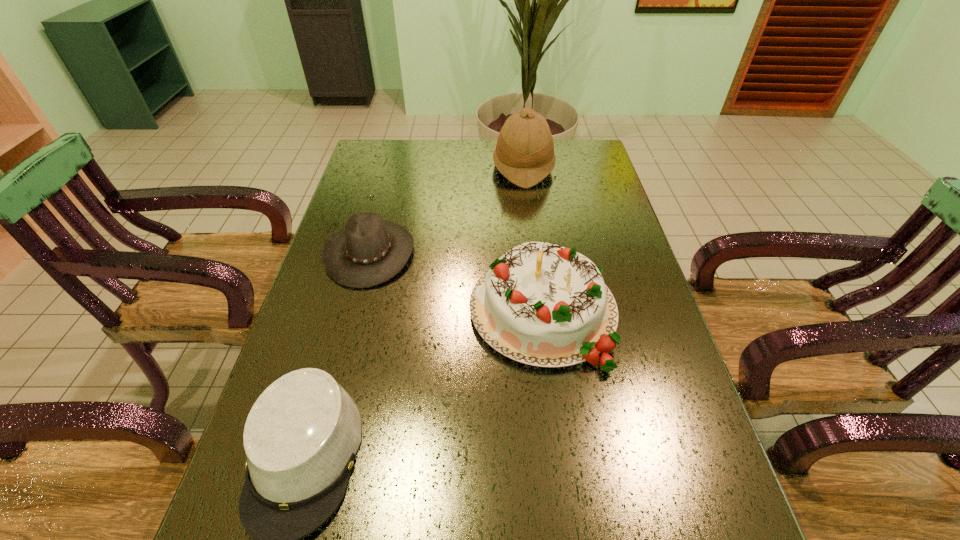
This screenshot has width=960, height=540. I want to click on object at the left edge, so click(x=368, y=251).

The image size is (960, 540). I want to click on object situated at the right edge, so click(x=541, y=304).

Where is `blank space at the far edge of the desktop`? The width and height of the screenshot is (960, 540). blank space at the far edge of the desktop is located at coordinates (429, 169).

Image resolution: width=960 pixels, height=540 pixels. Identify the location of vacant space at the left edge of the desktop. (396, 175).

The image size is (960, 540). In order to click on vacant space at the right edge of the desktop in this screenshot , I will do `click(591, 238)`.

This screenshot has height=540, width=960. In order to click on free spot at the far right corner of the desktop in this screenshot , I will do `click(574, 151)`.

Image resolution: width=960 pixels, height=540 pixels. I want to click on vacant space that is in between the second nearest hat and the farthest object, so click(x=446, y=210).

This screenshot has height=540, width=960. What are the coordinates of `unoccupied position between the rightmost hat and the second nearest hat` in the screenshot? It's located at (446, 210).

This screenshot has height=540, width=960. Find the location of `free spot between the second nearest hat and the cake`. free spot between the second nearest hat and the cake is located at coordinates (456, 282).

You are a GUI agent. You are given a task and a screenshot of the screen. Output one action in this format:
    pyautogui.click(x=<x>, y=<y>)
    Task: Click on the empty space that is in between the tallest hat and the cake
    Image resolution: width=960 pixels, height=540 pixels.
    Given the screenshot: What is the action you would take?
    [533, 239]